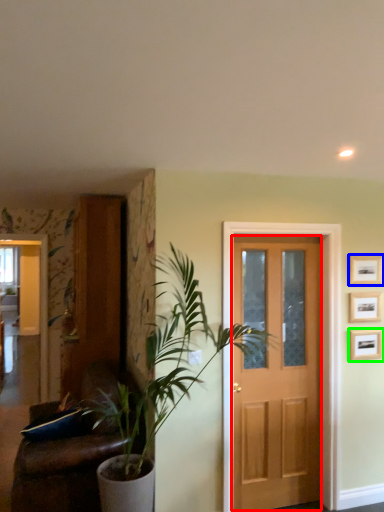
Question: Estimate the real-world distances between objects in this image. Which object is closer to screen door (highlighted by a red box), picture frame (highlighted by a blue box) or picture frame (highlighted by a green box)?

Choices:
 (A) picture frame
 (B) picture frame

Answer: (B)